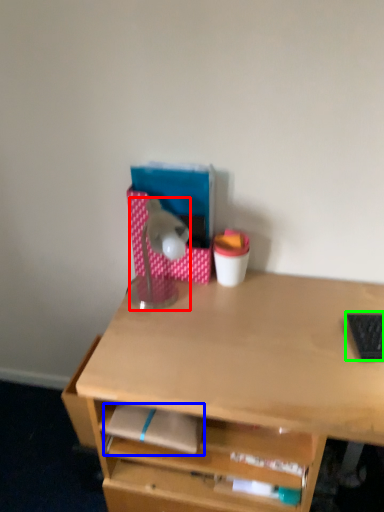
Question: Which object is the closest to the lamp (highlighted by a red box)? Choose among these: notepad (highlighted by a blue box) or laptop keyboard (highlighted by a green box).

Choices:
 (A) notepad
 (B) laptop keyboard

Answer: (A)